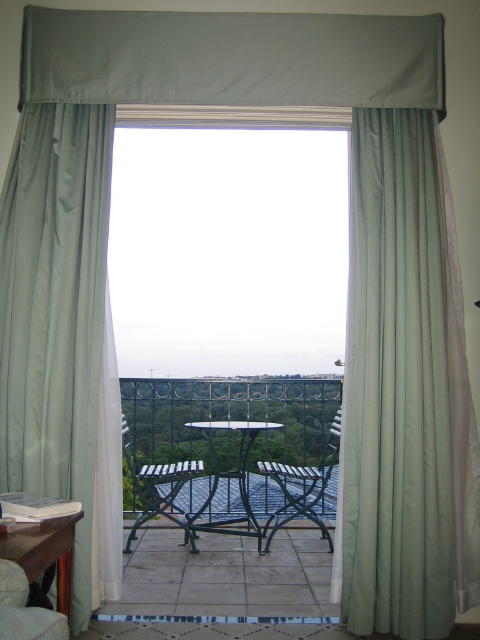
Can you confirm if metallic green armchair at center is positioned below metallic wrought iron table at center?

Correct, metallic green armchair at center is located below metallic wrought iron table at center.

Is metallic green armchair at center smaller than metallic wrought iron table at center?

Yes, metallic green armchair at center is smaller than metallic wrought iron table at center.

Who is more distant from viewer, (x=264, y=467) or (x=243, y=490)?

Point (x=243, y=490)

This screenshot has height=640, width=480. I want to click on metallic green armchair at center, so click(303, 486).

Is satin green curtain at left to the right of metallic green armchair at center from the viewer's perspective?

In fact, satin green curtain at left is to the left of metallic green armchair at center.

Does point (17, 420) come farther from viewer compared to point (273, 525)?

No, it is not.

Locate an element on the screen. This screenshot has width=480, height=640. satin green curtain at left is located at coordinates (56, 314).

Is wooden table at lower left below metallic blue armchair at center?

Actually, wooden table at lower left is above metallic blue armchair at center.

Is wooden table at lower left thinner than metallic blue armchair at center?

Yes.

Between point (54, 540) and point (167, 477), which one is positioned behind?

Point (167, 477)

You are a GUI agent. You are given a task and a screenshot of the screen. Output one action in this format:
    pyautogui.click(x=<x>, y=<y>)
    Task: Click on the wooden table at lower left
    The width and height of the screenshot is (480, 640).
    Given the screenshot: What is the action you would take?
    pyautogui.click(x=45, y=552)